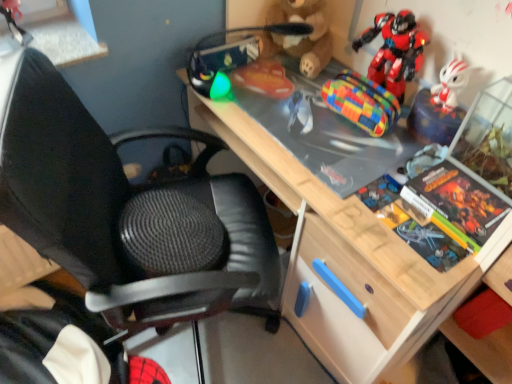
Question: Does wooden desk at center turn towards rubberized orange toy at upper center, which is the 4th toy in right-to-left order?

Choices:
 (A) no
 (B) yes

Answer: (B)

Question: Considering the relative sizes of wooden desk at center and rubberized orange toy at upper center, which is the 4th toy in right-to-left order, in the image provided, is wooden desk at center smaller than rubberized orange toy at upper center, which is the 4th toy in right-to-left order,?

Choices:
 (A) yes
 (B) no

Answer: (B)

Question: Can rubberized orange toy at upper center, arranged as the first toy when viewed from the left, be found inside wooden desk at center?

Choices:
 (A) yes
 (B) no

Answer: (A)

Question: Can you confirm if wooden desk at center is shorter than rubberized orange toy at upper center, arranged as the first toy when viewed from the left?

Choices:
 (A) yes
 (B) no

Answer: (B)

Question: Can you confirm if wooden desk at center is taller than rubberized orange toy at upper center, arranged as the first toy when viewed from the left?

Choices:
 (A) yes
 (B) no

Answer: (A)

Question: From a real-world perspective, is wooden desk at center on rubberized orange toy at upper center, which is the 4th toy in right-to-left order?

Choices:
 (A) yes
 (B) no

Answer: (B)

Question: From a real-world perspective, is black mesh chair at center under multicolored woven pouch at center, placed as the third toy when sorted from left to right?

Choices:
 (A) yes
 (B) no

Answer: (A)

Question: Is black mesh chair at center turned away from multicolored woven pouch at center, placed as the third toy when sorted from left to right?

Choices:
 (A) no
 (B) yes

Answer: (A)

Question: From a real-world perspective, is black mesh chair at center on multicolored woven pouch at center, arranged as the second toy when viewed from the right?

Choices:
 (A) no
 (B) yes

Answer: (A)

Question: Is black mesh chair at center far away from multicolored woven pouch at center, placed as the third toy when sorted from left to right?

Choices:
 (A) yes
 (B) no

Answer: (B)

Question: Is black mesh chair at center oriented towards multicolored woven pouch at center, arranged as the second toy when viewed from the right?

Choices:
 (A) yes
 (B) no

Answer: (A)

Question: Would you say multicolored woven pouch at center, arranged as the second toy when viewed from the right, is part of black mesh chair at center's contents?

Choices:
 (A) no
 (B) yes

Answer: (A)

Question: From the image's perspective, does rubberized orange toy at upper center, arranged as the first toy when viewed from the left, appear lower than wooden desk at center?

Choices:
 (A) yes
 (B) no

Answer: (B)